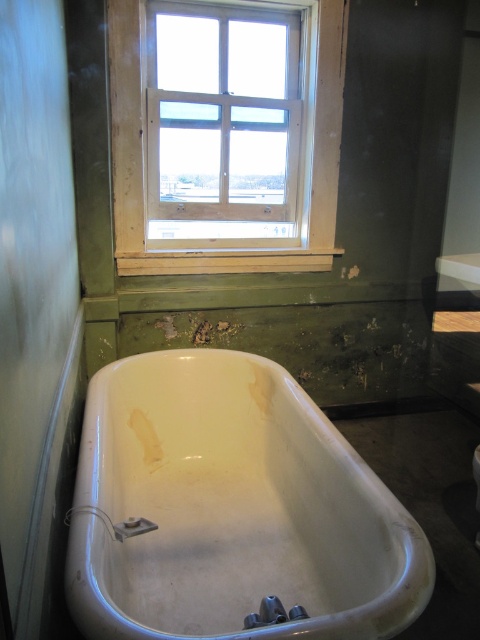
Is white glossy bathtub at lower center positioned at the back of white wooden window at upper center?

No, it is not.

Does white glossy bathtub at lower center appear under white wooden window at upper center?

Indeed, white glossy bathtub at lower center is positioned under white wooden window at upper center.

Where is `white glossy bathtub at lower center`? white glossy bathtub at lower center is located at coordinates (230, 509).

The image size is (480, 640). What are the coordinates of `white glossy bathtub at lower center` in the screenshot? It's located at (230, 509).